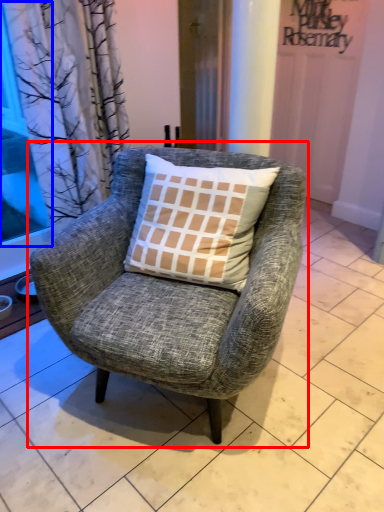
Question: Which object appears farthest to the camera in this image, chair (highlighted by a red box) or window screen (highlighted by a blue box)?

Choices:
 (A) chair
 (B) window screen

Answer: (B)